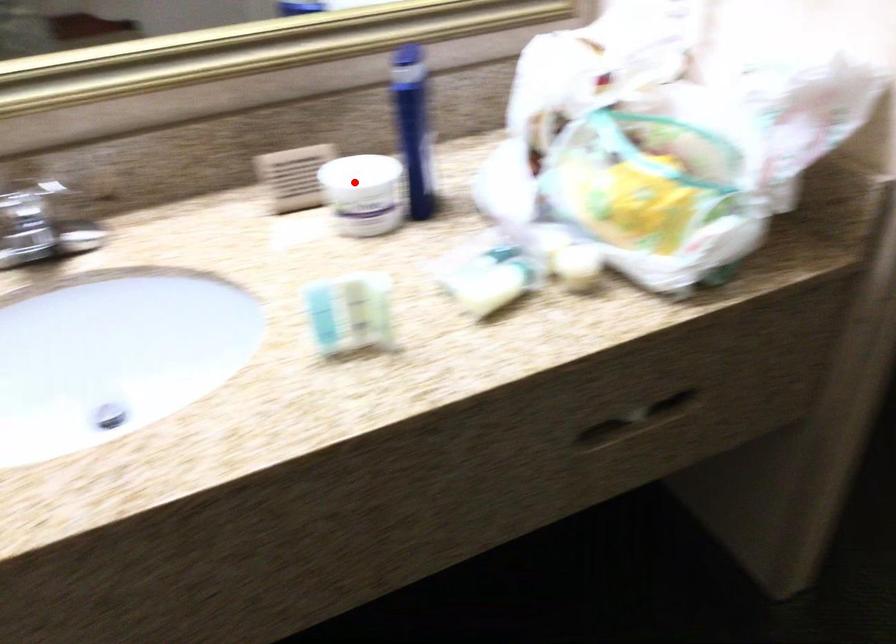
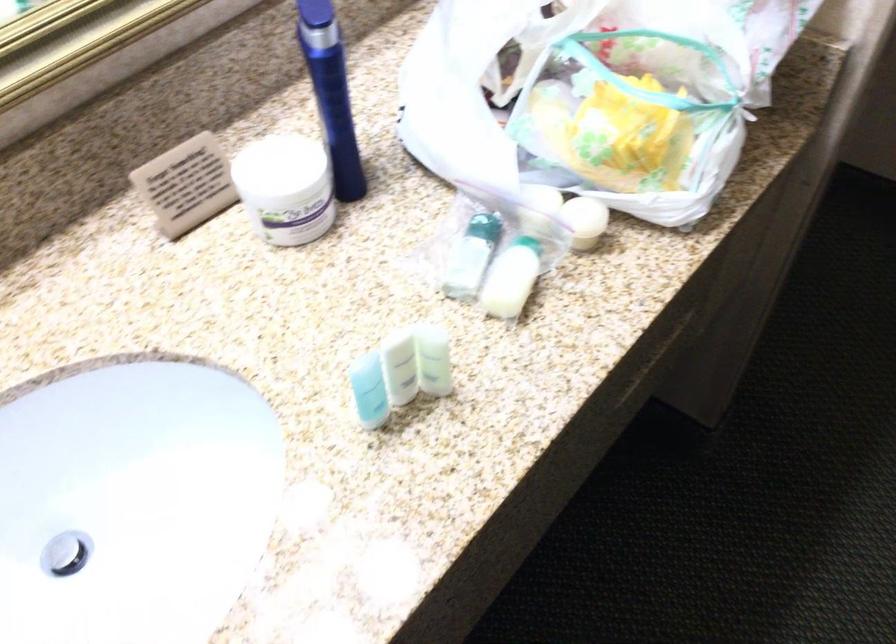
Question: I am providing you with two images of the same scene from different viewpoints. Image1 has a red point marked. In image2, the corresponding 3D location appears at what relative position? Reply with the corresponding letter.

Choices:
 (A) Closer
 (B) Farther

Answer: (A)